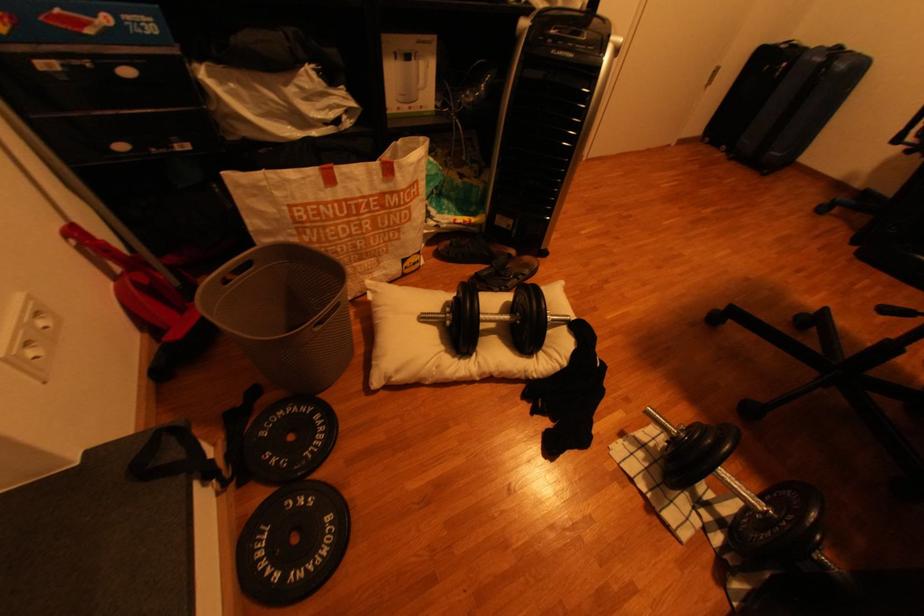
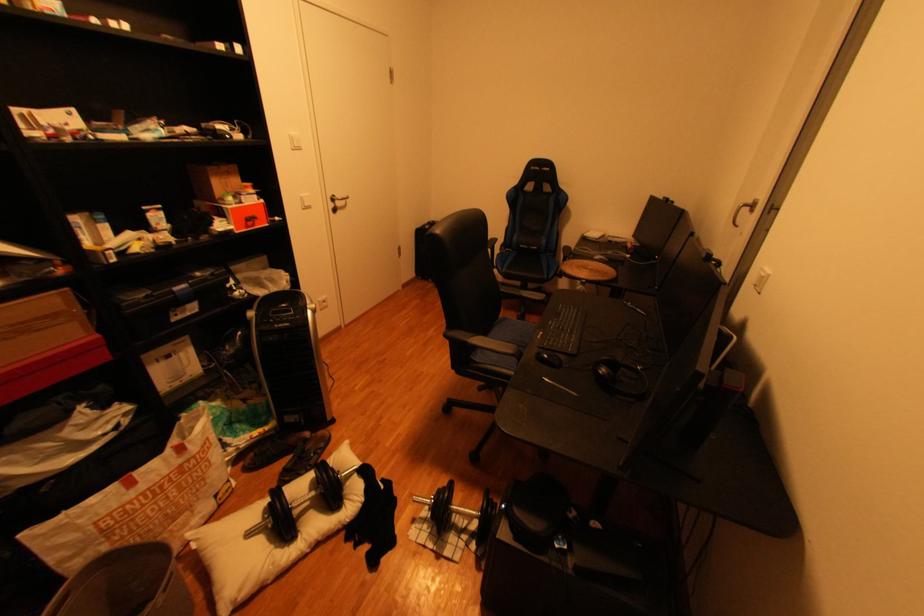
Locate, in the second image, the point that corresponds to the point at 655,469 in the first image.

(440, 533)